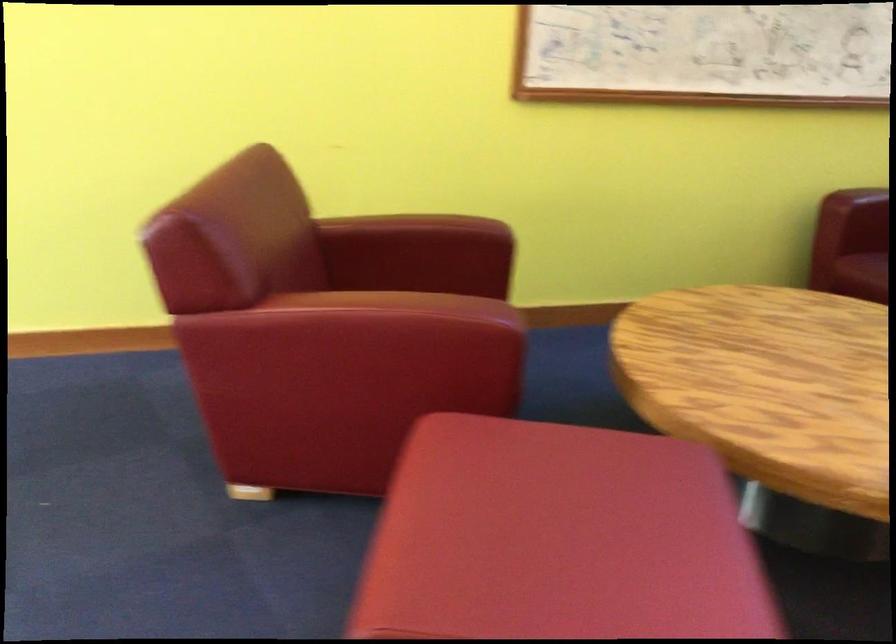
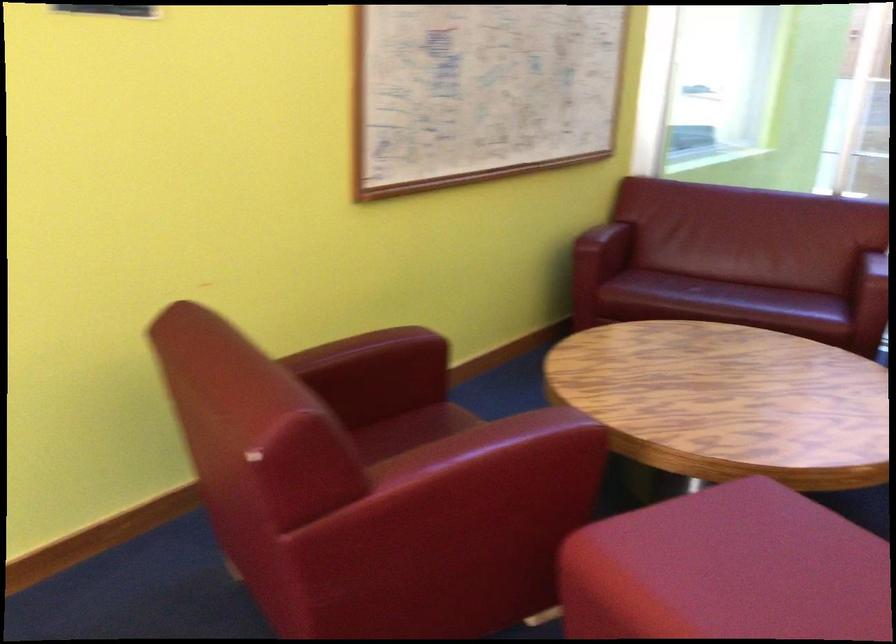
Find the pixel in the second image that matches (x=418, y=241) in the first image.

(375, 363)